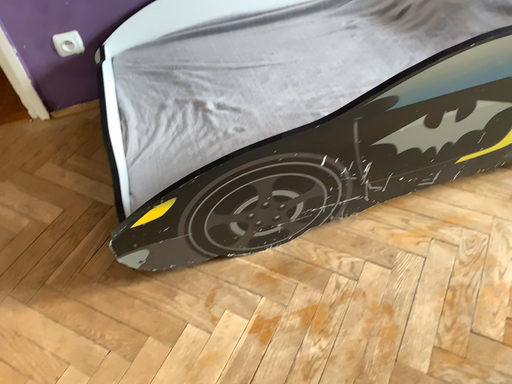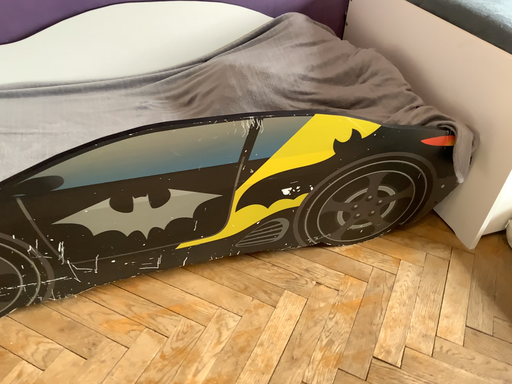
Question: How did the camera likely rotate when shooting the video?

Choices:
 (A) rotated right
 (B) rotated left

Answer: (A)